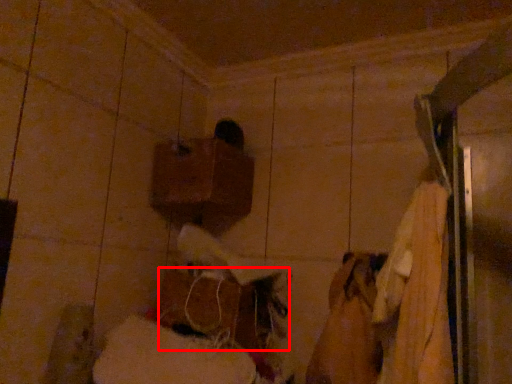
Question: From the image's perspective, what is the correct spatial relationship of wood (annotated by the red box) in relation to wood?

Choices:
 (A) below
 (B) above

Answer: (A)